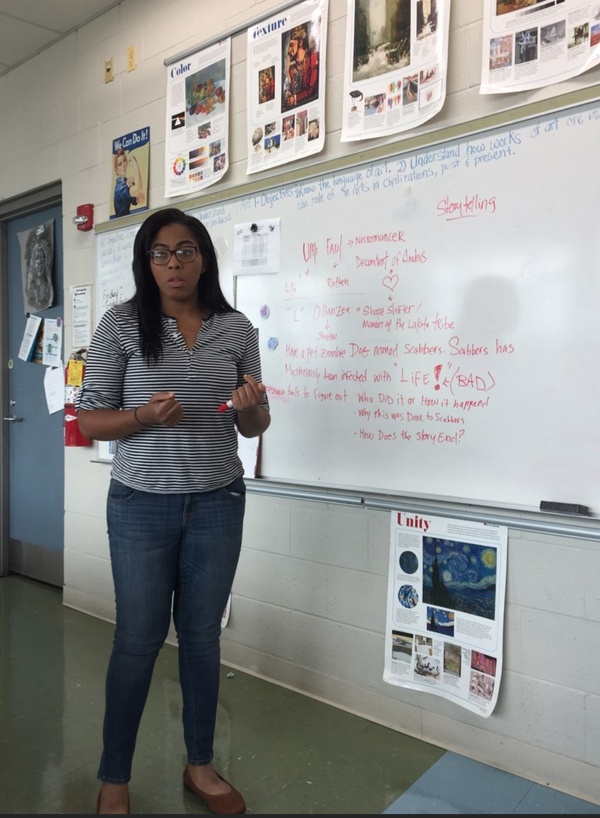
Locate an element on the screen. The height and width of the screenshot is (818, 600). poster is located at coordinates (453, 546).